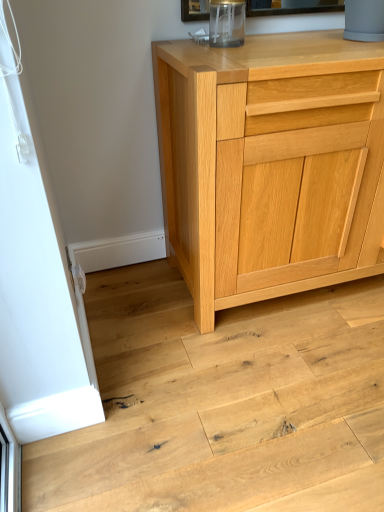
Where is `natural wood cabinet at center`? The height and width of the screenshot is (512, 384). natural wood cabinet at center is located at coordinates (270, 164).

What do you see at coordinates (270, 164) in the screenshot? This screenshot has height=512, width=384. I see `natural wood cabinet at center` at bounding box center [270, 164].

Find the location of a particular element. natural wood floor at lower left is located at coordinates (223, 403).

This screenshot has height=512, width=384. Describe the element at coordinates (223, 403) in the screenshot. I see `natural wood floor at lower left` at that location.

The width and height of the screenshot is (384, 512). I want to click on natural wood cabinet at center, so click(270, 164).

Considering the relative positions of natural wood cabinet at center and natural wood floor at lower left in the image provided, is natural wood cabinet at center to the right of natural wood floor at lower left from the viewer's perspective?

Indeed, natural wood cabinet at center is positioned on the right side of natural wood floor at lower left.

Relative to natural wood floor at lower left, is natural wood cabinet at center in front or behind?

Visually, natural wood cabinet at center is located behind natural wood floor at lower left.

Is point (375, 126) closer or farther from the camera than point (212, 499)?

Clearly, point (375, 126) is more distant from the camera than point (212, 499).

Consider the image. From the image's perspective, which one is positioned higher, natural wood cabinet at center or natural wood floor at lower left?

natural wood cabinet at center.

From a real-world perspective, is natural wood cabinet at center positioned over natural wood floor at lower left based on gravity?

Yes, from a real-world perspective, natural wood cabinet at center is above natural wood floor at lower left.

Looking at their sizes, would you say natural wood cabinet at center is wider or thinner than natural wood floor at lower left?

natural wood cabinet at center is thinner than natural wood floor at lower left.

Considering the relative sizes of natural wood cabinet at center and natural wood floor at lower left in the image provided, is natural wood cabinet at center taller than natural wood floor at lower left?

Indeed, natural wood cabinet at center has a greater height compared to natural wood floor at lower left.

Which of these two, natural wood cabinet at center or natural wood floor at lower left, is smaller?

natural wood floor at lower left is smaller.

Is natural wood floor at lower left inside natural wood cabinet at center?

No, natural wood floor at lower left is not a part of natural wood cabinet at center.

Is the surface of natural wood cabinet at center in direct contact with natural wood floor at lower left?

No, natural wood cabinet at center is not beside natural wood floor at lower left.

Is natural wood cabinet at center looking in the opposite direction of natural wood floor at lower left?

natural wood cabinet at center does not have its back to natural wood floor at lower left.

Can you tell me how much natural wood cabinet at center and natural wood floor at lower left differ in facing direction?

natural wood cabinet at center and natural wood floor at lower left are facing 0.905 degrees away from each other.

How far apart are natural wood cabinet at center and natural wood floor at lower left?

A distance of 45.24 centimeters exists between natural wood cabinet at center and natural wood floor at lower left.

Locate an element on the screen. The width and height of the screenshot is (384, 512). chest of drawers behind the natural wood floor at lower left is located at coordinates (270, 164).

Which object is positioned more to the right, natural wood floor at lower left or natural wood cabinet at center?

natural wood cabinet at center is more to the right.

Which is behind, natural wood floor at lower left or natural wood cabinet at center?

natural wood cabinet at center is more distant.

Considering the points (111, 464) and (298, 117), which point is in front, point (111, 464) or point (298, 117)?

Point (111, 464)

From the image's perspective, does natural wood floor at lower left appear lower than natural wood cabinet at center?

Yes, from the image's perspective, natural wood floor at lower left is below natural wood cabinet at center.

From a real-world perspective, which is physically above, natural wood floor at lower left or natural wood cabinet at center?

natural wood cabinet at center.

In terms of width, does natural wood floor at lower left look wider or thinner when compared to natural wood cabinet at center?

Considering their sizes, natural wood floor at lower left looks broader than natural wood cabinet at center.

Considering the relative sizes of natural wood floor at lower left and natural wood cabinet at center in the image provided, is natural wood floor at lower left taller than natural wood cabinet at center?

No.

Is natural wood floor at lower left bigger or smaller than natural wood cabinet at center?

In the image, natural wood floor at lower left appears to be smaller than natural wood cabinet at center.

Can we say natural wood floor at lower left lies outside natural wood cabinet at center?

Absolutely, natural wood floor at lower left is external to natural wood cabinet at center.

Would you say natural wood floor at lower left is a long distance from natural wood cabinet at center?

No.

Is natural wood floor at lower left oriented away from natural wood cabinet at center?

No, natural wood cabinet at center is not at the back of natural wood floor at lower left.

Identify the location of the chest of drawers above the natural wood floor at lower left (from a real-world perspective). (270, 164).

Identify the location of stair directly beneath the natural wood cabinet at center (from a real-world perspective). Image resolution: width=384 pixels, height=512 pixels. (223, 403).

The height and width of the screenshot is (512, 384). What are the coordinates of `stair below the natural wood cabinet at center (from the image's perspective)` in the screenshot? It's located at (223, 403).